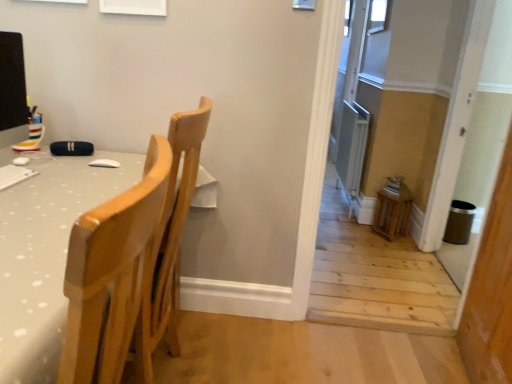
The width and height of the screenshot is (512, 384). I want to click on clear glass window at upper right, placed as the 2th window when sorted from right to left, so click(377, 16).

What do you see at coordinates (490, 289) in the screenshot?
I see `metallic silver screen door at right` at bounding box center [490, 289].

Find the location of a particular element. Image resolution: width=512 pixels, height=384 pixels. metallic silver screen door at right is located at coordinates tap(490, 289).

How much space does transparent glass window at upper center, which is the second window from front to back, occupy horizontally?

transparent glass window at upper center, which is the second window from front to back, is 1.56 inches in width.

Where is `transparent glass window at upper center, the second window from the bottom`? The image size is (512, 384). transparent glass window at upper center, the second window from the bottom is located at coordinates (347, 17).

In order to face matte black monitor at left, should I rotate leftwards or rightwards?

Rotate left and turn 32.065 degrees.

This screenshot has width=512, height=384. What do you see at coordinates (114, 276) in the screenshot? I see `light wood chair at left` at bounding box center [114, 276].

Where is `clear glass window at upper right, placed as the 2th window when sorted from right to left`? Image resolution: width=512 pixels, height=384 pixels. clear glass window at upper right, placed as the 2th window when sorted from right to left is located at coordinates (377, 16).

Which object is thinner, clear glass window at upper right, the first window positioned from the front, or light wood chair at left?

clear glass window at upper right, the first window positioned from the front.

From a real-world perspective, relative to light wood chair at left, is clear glass window at upper right, placed as the 2th window when sorted from right to left, vertically above or below?

From a real-world perspective, clear glass window at upper right, placed as the 2th window when sorted from right to left, is physically above light wood chair at left.

Is point (381, 2) positioned before point (119, 225)?

No.

Which of these two, clear glass window at upper right, the 2th window positioned from the back, or light wood chair at left, stands taller?

light wood chair at left is taller.

Is point (146, 349) less distant than point (348, 13)?

Yes.

Is light wood chair at left taller than transparent glass window at upper center, which appears as the first window when viewed from the back?

Yes, light wood chair at left is taller than transparent glass window at upper center, which appears as the first window when viewed from the back.

Can you confirm if light wood chair at left is positioned to the right of transparent glass window at upper center, placed as the second window when sorted from left to right?

In fact, light wood chair at left is to the left of transparent glass window at upper center, placed as the second window when sorted from left to right.

There is a matte black monitor at left. Identify the location of the 1st window above it (from the image's perspective). The width and height of the screenshot is (512, 384). (377, 16).

From the image's perspective, which one is positioned higher, matte black monitor at left or clear glass window at upper right, the first window ordered from the bottom?

clear glass window at upper right, the first window ordered from the bottom, appears higher in the image.

Consider the image. From a real-world perspective, is matte black monitor at left positioned above or below clear glass window at upper right, the first window positioned from the front?

matte black monitor at left is situated lower than clear glass window at upper right, the first window positioned from the front, in the real world.

From the image's perspective, is light wood chair at left located above clear glass window at upper right, the first window positioned from the front?

No, from the image's perspective, light wood chair at left is not on top of clear glass window at upper right, the first window positioned from the front.

Is point (95, 247) positioned before point (383, 7)?

Yes, point (95, 247) is in front of point (383, 7).

Are light wood chair at left and clear glass window at upper right, the first window ordered from the bottom, located far from each other?

Indeed, light wood chair at left is not near clear glass window at upper right, the first window ordered from the bottom.

Is light wood chair at left further to the viewer compared to clear glass window at upper right, placed as the 2th window when sorted from right to left?

No.

Would you say matte black monitor at left is inside or outside transparent glass window at upper center, the second window from the bottom?

matte black monitor at left cannot be found inside transparent glass window at upper center, the second window from the bottom.

Does matte black monitor at left turn towards transparent glass window at upper center, the first window in the right-to-left sequence?

No, matte black monitor at left is not facing towards transparent glass window at upper center, the first window in the right-to-left sequence.

From a real-world perspective, which is physically below, matte black monitor at left or transparent glass window at upper center, the second window from the bottom?

matte black monitor at left is physically lower.

From the image's perspective, which is above, matte black monitor at left or transparent glass window at upper center, acting as the first window starting from the top?

transparent glass window at upper center, acting as the first window starting from the top, appears higher in the image.

Is clear glass window at upper right, the first window ordered from the bottom, inside the boundaries of transparent glass window at upper center, the second window from the bottom, or outside?

The correct answer is: outside.

From a real-world perspective, is clear glass window at upper right, which ranks as the first window in left-to-right order, on transparent glass window at upper center, the first window in the right-to-left sequence?

No.

Which object is wider, clear glass window at upper right, placed as the 2th window when sorted from right to left, or transparent glass window at upper center, the first window in the right-to-left sequence?

Wider between the two is transparent glass window at upper center, the first window in the right-to-left sequence.

Does clear glass window at upper right, the second window when ordered from top to bottom, have a lesser height compared to transparent glass window at upper center, which appears as the first window when viewed from the back?

Yes, clear glass window at upper right, the second window when ordered from top to bottom, is shorter than transparent glass window at upper center, which appears as the first window when viewed from the back.

At what (x,y) coordinates should I click in order to perform the action: click on the 1st window positioned above the matte black monitor at left (from a real-world perspective). Please return your answer as a coordinate pair (x, y). The image size is (512, 384). Looking at the image, I should click on (377, 16).

How different are the orientations of clear glass window at upper right, the first window ordered from the bottom, and matte black monitor at left in degrees?

They differ by 180 degrees in their facing directions.

Which object is more forward, clear glass window at upper right, the first window ordered from the bottom, or matte black monitor at left?

matte black monitor at left.

From a real-world perspective, between clear glass window at upper right, which ranks as the first window in left-to-right order, and matte black monitor at left, who is vertically lower?

matte black monitor at left, from a real-world perspective.

Identify the location of the 1st window to the right when counting from the light wood chair at left. (377, 16).

You are a GUI agent. You are given a task and a screenshot of the screen. Output one action in this format:
    pyautogui.click(x=<x>, y=<y>)
    Task: Click on the chair in front of the transparent glass window at upper center, which appears as the first window when viewed from the back
    The image size is (512, 384).
    Given the screenshot: What is the action you would take?
    pyautogui.click(x=114, y=276)

From the image, which object appears to be nearer to light wood chair at left, metallic silver screen door at right or matte black monitor at left?

Among the two, matte black monitor at left is located nearer to light wood chair at left.

In the scene shown: Considering their positions, is transparent glass window at upper center, the first window in the right-to-left sequence, positioned closer to matte black monitor at left than light wood chair at left?

The object closer to matte black monitor at left is light wood chair at left.

Based on their spatial positions, is transparent glass window at upper center, which is the second window from front to back, or matte black monitor at left further from clear glass window at upper right, which ranks as the first window in left-to-right order?

The object further to clear glass window at upper right, which ranks as the first window in left-to-right order, is matte black monitor at left.

Estimate the real-world distances between objects in this image. Which object is further from metallic silver screen door at right, light wood chair at left or transparent glass window at upper center, placed as the second window when sorted from left to right?

transparent glass window at upper center, placed as the second window when sorted from left to right, is further to metallic silver screen door at right.

Looking at the image, which one is located closer to clear glass window at upper right, the 2th window positioned from the back, metallic silver screen door at right or transparent glass window at upper center, acting as the first window starting from the top?

transparent glass window at upper center, acting as the first window starting from the top, is closer to clear glass window at upper right, the 2th window positioned from the back.

Looking at the image, which one is located closer to clear glass window at upper right, the first window ordered from the bottom, light wood chair at left or transparent glass window at upper center, which appears as the first window when viewed from the back?

The object closer to clear glass window at upper right, the first window ordered from the bottom, is transparent glass window at upper center, which appears as the first window when viewed from the back.

From the picture: From the image, which object appears to be nearer to light wood chair at left, matte black monitor at left or clear glass window at upper right, the first window ordered from the bottom?

matte black monitor at left is closer to light wood chair at left.

Based on the photo, based on their spatial positions, is matte black monitor at left or light wood chair at left closer to clear glass window at upper right, the 2th window positioned from the back?

matte black monitor at left is closer to clear glass window at upper right, the 2th window positioned from the back.

The height and width of the screenshot is (384, 512). Identify the location of window between matte black monitor at left and transparent glass window at upper center, the first window in the right-to-left sequence, in the front-back direction. (377, 16).

The image size is (512, 384). I want to click on window positioned between light wood chair at left and transparent glass window at upper center, which appears as the first window when viewed from the back, from near to far, so click(x=377, y=16).

Find the location of `window located between metallic silver screen door at right and transparent glass window at upper center, the first window in the right-to-left sequence, in the depth direction`. window located between metallic silver screen door at right and transparent glass window at upper center, the first window in the right-to-left sequence, in the depth direction is located at coordinates coord(377,16).

At what (x,y) coordinates should I click in order to perform the action: click on screen door between light wood chair at left and clear glass window at upper right, the 2th window positioned from the back, along the z-axis. Please return your answer as a coordinate pair (x, y). Looking at the image, I should click on (490, 289).